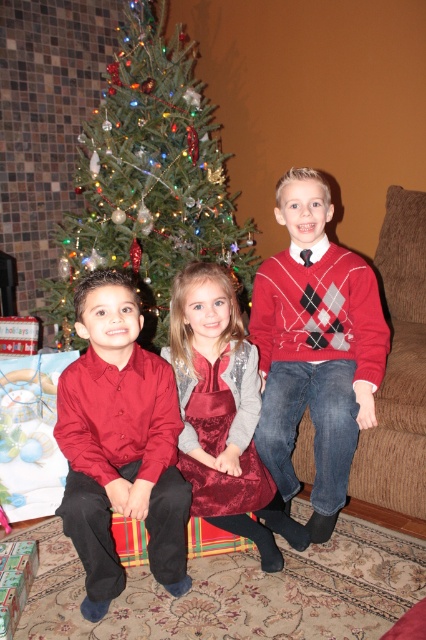
Question: Is argyle sweater at center thinner than velvet dress at center?

Choices:
 (A) no
 (B) yes

Answer: (B)

Question: Which object is closer to the camera taking this photo?

Choices:
 (A) green textured christmas tree at upper center
 (B) matte red shirt at center
 (C) argyle sweater at center

Answer: (B)

Question: Is green textured christmas tree at upper center positioned before matte red shirt at center?

Choices:
 (A) yes
 (B) no

Answer: (B)

Question: In this image, where is argyle sweater at center located relative to matte red shirt at center?

Choices:
 (A) right
 (B) left

Answer: (A)

Question: Which point is closer to the camera?

Choices:
 (A) (265, 390)
 (B) (198, 106)
 (C) (155, 545)

Answer: (C)

Question: Based on their relative distances, which object is farther from the green textured christmas tree at upper center?

Choices:
 (A) matte red shirt at center
 (B) argyle sweater at center

Answer: (A)